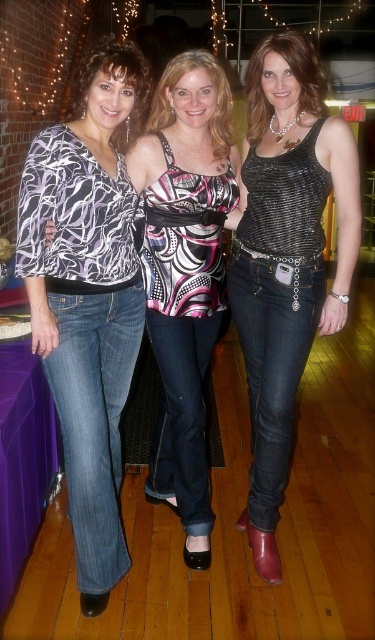
You are at a party and want to know which top is more eye catching between the sparkly metallic tank top at center and the matte black top at center. Based on their appearance, which one do you think stands out more?

The sparkly metallic tank top at center is larger in size than the matte black top at center, making it more eye catching.

You are a fashion designer observing the three women at the event. You notice the sparkly metallic tank top at center and the matte pink tank top at center. Which one has a bigger size?

The sparkly metallic tank top at center is larger in size than the matte pink tank top at center.